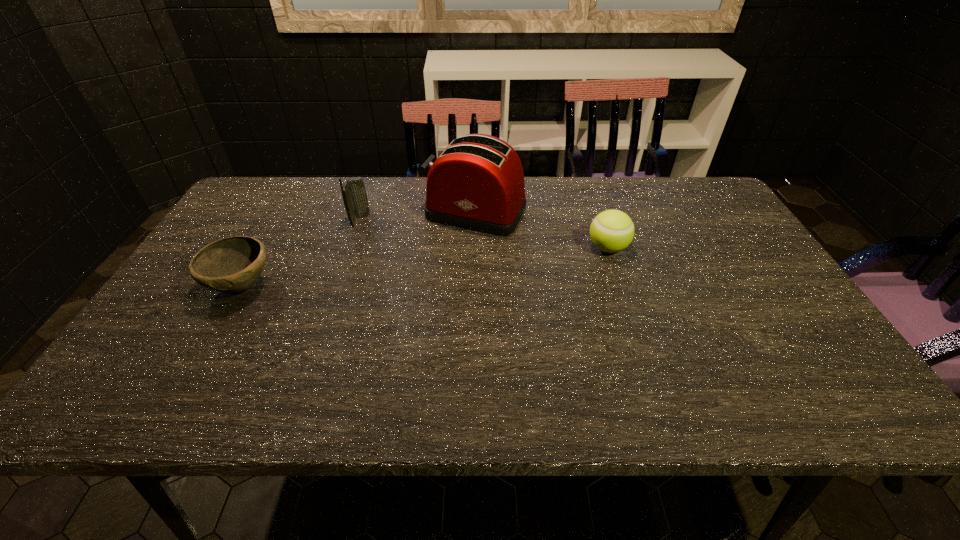
Where is `toaster`? Image resolution: width=960 pixels, height=540 pixels. toaster is located at coordinates (477, 183).

Where is `the tallest object`? Image resolution: width=960 pixels, height=540 pixels. the tallest object is located at coordinates (477, 183).

Locate an element on the screen. Image resolution: width=960 pixels, height=540 pixels. cellular telephone is located at coordinates (354, 195).

Locate an element on the screen. This screenshot has width=960, height=540. the third object from right to left is located at coordinates (354, 195).

Identify the location of tennis ball. Image resolution: width=960 pixels, height=540 pixels. (611, 231).

Image resolution: width=960 pixels, height=540 pixels. I want to click on the leftmost object, so click(x=233, y=264).

Identify the location of bowl. This screenshot has height=540, width=960. (233, 264).

Where is `vacant space situated on the right of the tallest object`? The width and height of the screenshot is (960, 540). vacant space situated on the right of the tallest object is located at coordinates (621, 212).

I want to click on free space located on the keyboard of the third shortest object, so click(x=409, y=220).

Find the location of a particular element. Image resolution: width=960 pixels, height=540 pixels. vacant space located 0.340m on the left of the tennis ball is located at coordinates (464, 248).